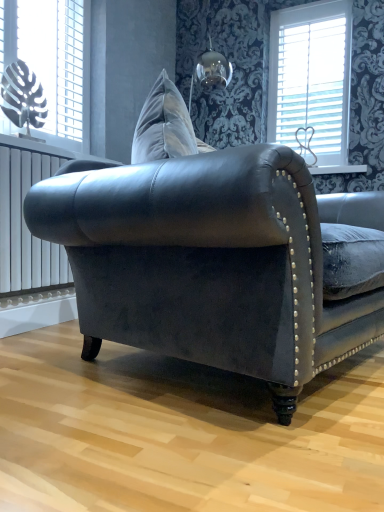
Question: Is point (327, 174) positioned closer to the camera than point (8, 22)?

Choices:
 (A) closer
 (B) farther

Answer: (B)

Question: In terms of height, does white glossy window sill at upper center look taller or shorter compared to white plastic monstera leaf at upper left, which is the second window in right-to-left order?

Choices:
 (A) tall
 (B) short

Answer: (B)

Question: Based on their relative distances, which object is farther from the white glossy window sill at upper center?

Choices:
 (A) white plastic monstera leaf at upper left, which appears as the first window when viewed from the front
 (B) white wooden blinds at upper right, marked as the first window in a back-to-front arrangement
 (C) velvet dark gray couch at center
 (D) white metallic radiator at left

Answer: (C)

Question: Estimate the real-world distances between objects in this image. Which object is farther from the velvet dark gray couch at center?

Choices:
 (A) white glossy window sill at upper center
 (B) white wooden blinds at upper right, which is counted as the second window, starting from the left
 (C) white plastic monstera leaf at upper left, which is the second window in right-to-left order
 (D) white metallic radiator at left

Answer: (B)